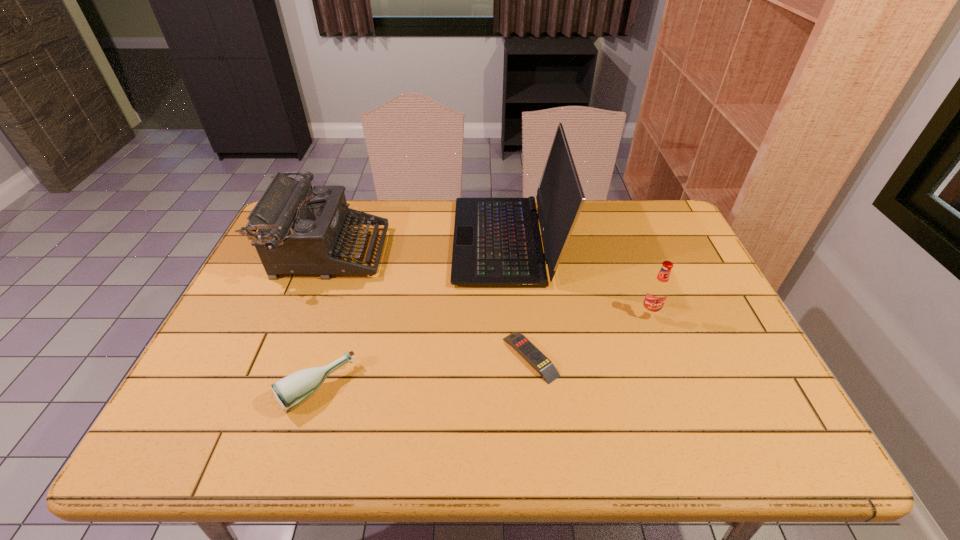
Where is `vacant space at the left edge`? vacant space at the left edge is located at coordinates (251, 288).

Image resolution: width=960 pixels, height=540 pixels. I want to click on free space at the right edge of the desktop, so click(748, 383).

In the image, there is a desktop. Identify the location of vacant space at the far right corner. (653, 238).

Locate an element on the screen. The image size is (960, 540). free space between the root beer and the fourth tallest object is located at coordinates (483, 351).

Locate an element on the screen. The image size is (960, 540). empty location between the rightmost object and the remote control is located at coordinates (589, 335).

This screenshot has width=960, height=540. Find the location of `free space between the root beer and the laptop computer`. free space between the root beer and the laptop computer is located at coordinates (578, 278).

You are a GUI agent. You are given a task and a screenshot of the screen. Output one action in this format:
    pyautogui.click(x=<x>, y=<y>)
    Task: Click on the free space that is in between the typewriter and the bottle
    
    Given the screenshot: What is the action you would take?
    pyautogui.click(x=323, y=320)

You are a GUI agent. You are given a task and a screenshot of the screen. Output one action in this format:
    pyautogui.click(x=<x>, y=<y>)
    Task: Click on the free point between the shortest object and the tallest object
    The height and width of the screenshot is (540, 960).
    Given the screenshot: What is the action you would take?
    pyautogui.click(x=518, y=299)

Find the location of a particular element. free area in between the third farthest object and the laptop computer is located at coordinates (x=578, y=278).

You are a GUI agent. You are given a task and a screenshot of the screen. Output one action in this format:
    pyautogui.click(x=<x>, y=<y>)
    Task: Click on the vacant region between the laptop computer and the fourth shortest object
    
    Given the screenshot: What is the action you would take?
    pyautogui.click(x=418, y=246)